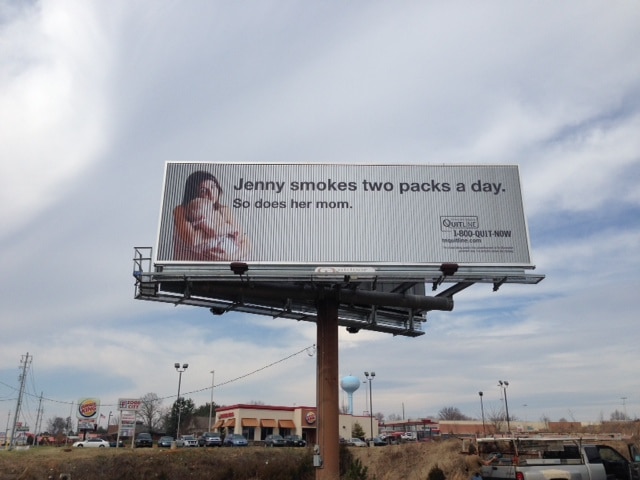
I want to click on electric holder, so click(x=317, y=463).